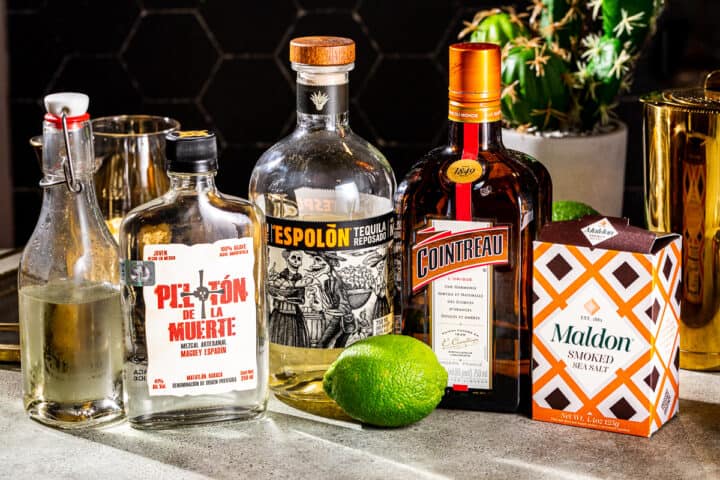
This screenshot has height=480, width=720. Identify the location of liquor. (332, 257).